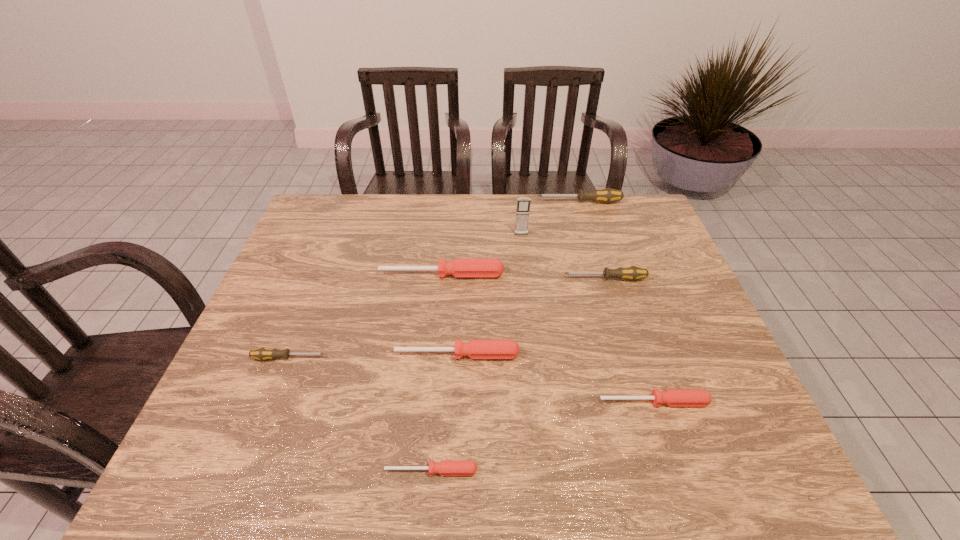
Where is `free point between the second biggest red screwdriver and the farthest screwdriver`? This screenshot has width=960, height=540. free point between the second biggest red screwdriver and the farthest screwdriver is located at coordinates (518, 278).

Identify the location of free space between the second biggest gray screwdriver and the third smallest red screwdriver. Image resolution: width=960 pixels, height=540 pixels. (531, 316).

Where is `free spot between the smallest red screwdriver and the third smallest red screwdriver`? The width and height of the screenshot is (960, 540). free spot between the smallest red screwdriver and the third smallest red screwdriver is located at coordinates (444, 413).

The image size is (960, 540). I want to click on free space that is in between the seventh nearest object and the third nearest red screwdriver, so click(x=490, y=295).

Locate which object ranks third in proximity to the nearest gray screwdriver. Please provide its 2D coordinates. Your answer should be formatted as a tuple, i.e. [(x, y)], where the tuple contains the x and y coordinates of a point satisfying the conditions above.

[(446, 467)]

Locate which object is the second closest to the smallest red screwdriver. Please provide its 2D coordinates. Your answer should be formatted as a tuple, i.e. [(x, y)], where the tuple contains the x and y coordinates of a point satisfying the conditions above.

[(672, 397)]

The image size is (960, 540). What are the coordinates of `screwdriver that can be found as the sixth closest to the biggest red screwdriver` in the screenshot? It's located at (446, 467).

Find the location of a particular element. screwdriver identified as the second closest to the second farthest red screwdriver is located at coordinates (672, 397).

Locate an element on the screen. The width and height of the screenshot is (960, 540). gray screwdriver that can be found as the closest to the second nearest gray screwdriver is located at coordinates (607, 195).

Identify which gray screwdriver is located as the second nearest to the second biggest red screwdriver. Please provide its 2D coordinates. Your answer should be formatted as a tuple, i.e. [(x, y)], where the tuple contains the x and y coordinates of a point satisfying the conditions above.

[(632, 273)]